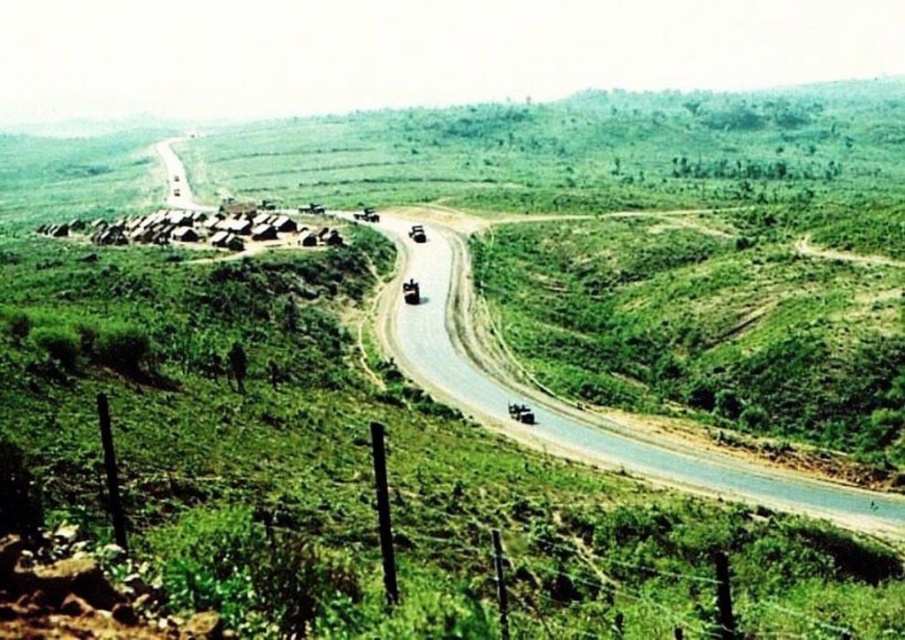
Which is more to the right, asphalt road at center or asphalt road at upper left?

asphalt road at center

Between asphalt road at center and asphalt road at upper left, which one has more height?

asphalt road at upper left is taller.

Where is `asphalt road at center`? This screenshot has height=640, width=905. asphalt road at center is located at coordinates (570, 404).